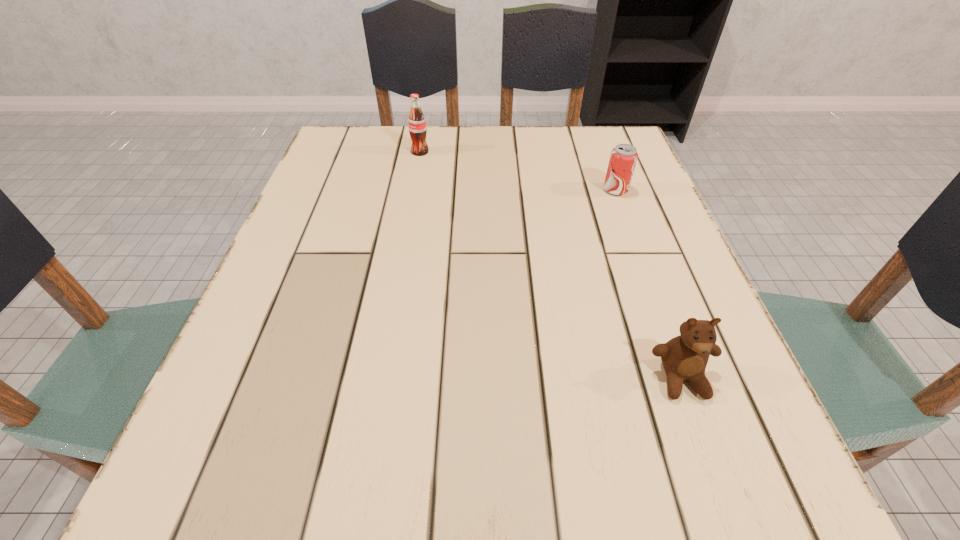
The height and width of the screenshot is (540, 960). I want to click on the taller soda can, so click(x=417, y=125).

Locate an element on the screen. the leftmost object is located at coordinates (417, 125).

This screenshot has width=960, height=540. I want to click on the nearest object, so pyautogui.click(x=685, y=357).

Identify the location of the right soda can. This screenshot has height=540, width=960. (623, 158).

You are a GUI agent. You are given a task and a screenshot of the screen. Output one action in this format:
    pyautogui.click(x=<x>, y=<y>)
    Task: Click on the nearer soda can
    This screenshot has width=960, height=540.
    Given the screenshot: What is the action you would take?
    pyautogui.click(x=623, y=158)

Find the location of a particular element. vacant space located on the left of the leftmost object is located at coordinates (392, 152).

In order to click on free location located at the face of the nearest object in this screenshot , I will do `click(722, 492)`.

Locate an element on the screen. This screenshot has height=540, width=960. free region located on the front of the right soda can is located at coordinates (634, 239).

Locate an element on the screen. object at the far edge is located at coordinates (417, 125).

Identify the location of teddy bear positioned at the right edge. The width and height of the screenshot is (960, 540). (685, 357).